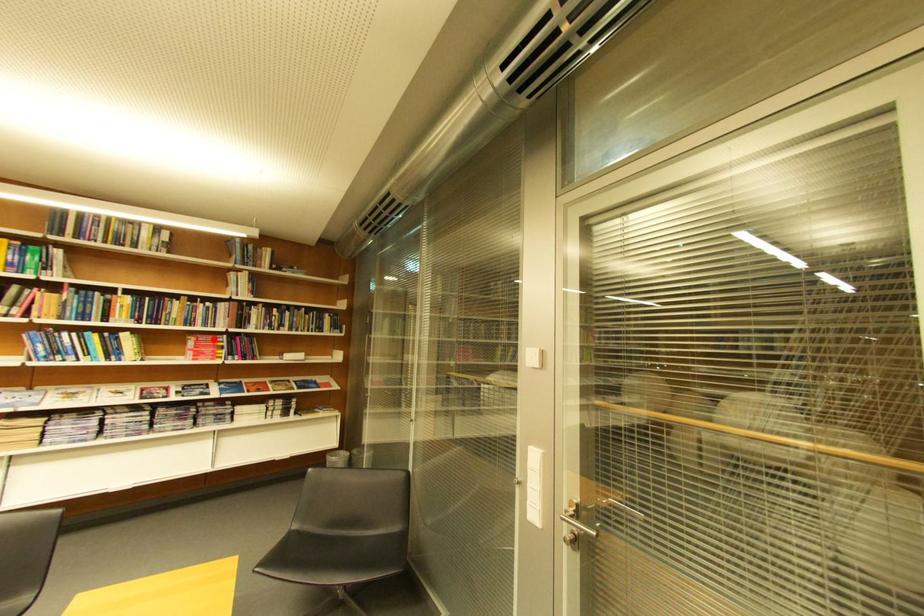
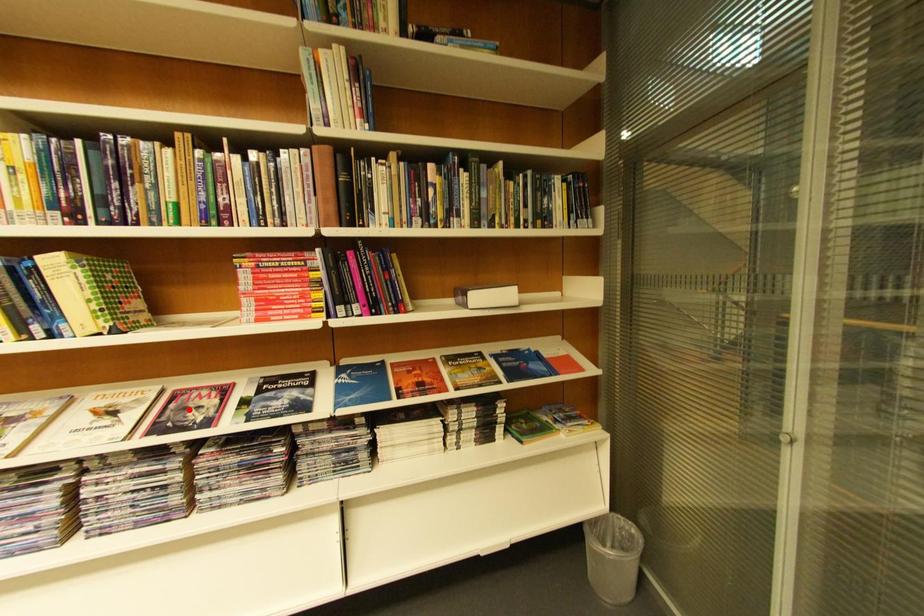
I am providing you with two images of the same scene from different viewpoints. A red point is marked on the first image and another point is marked on the second image. Are the points marked in image1 and image2 representing the same 3D position?

No